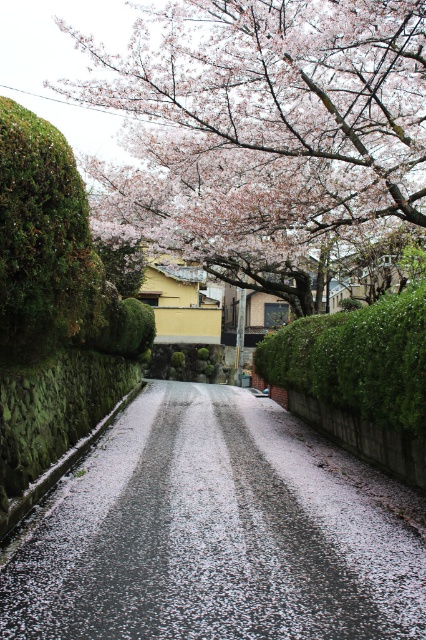
Can you confirm if smooth pink blossoms at upper center is smaller than green leafy hedge at center?

Actually, smooth pink blossoms at upper center might be larger than green leafy hedge at center.

Is the position of smooth pink blossoms at upper center less distant than that of green leafy hedge at center?

No, smooth pink blossoms at upper center is further to the viewer.

Between point (155, 120) and point (316, 392), which one is positioned in front?

Positioned in front is point (316, 392).

Where is `smooth pink blossoms at upper center`? smooth pink blossoms at upper center is located at coordinates (264, 129).

Who is shorter, white textured road at center or smooth pink blossoms at upper center?

white textured road at center is shorter.

Between white textured road at center and smooth pink blossoms at upper center, which one is positioned higher?

smooth pink blossoms at upper center

This screenshot has height=640, width=426. I want to click on white textured road at center, so click(215, 532).

Between white textured road at center and green leafy hedge at center, which one is positioned higher?

Positioned higher is green leafy hedge at center.

Is white textured road at center thinner than green leafy hedge at center?

In fact, white textured road at center might be wider than green leafy hedge at center.

Is point (86, 604) less distant than point (420, 346)?

Yes, it is.

This screenshot has width=426, height=640. I want to click on white textured road at center, so click(x=215, y=532).